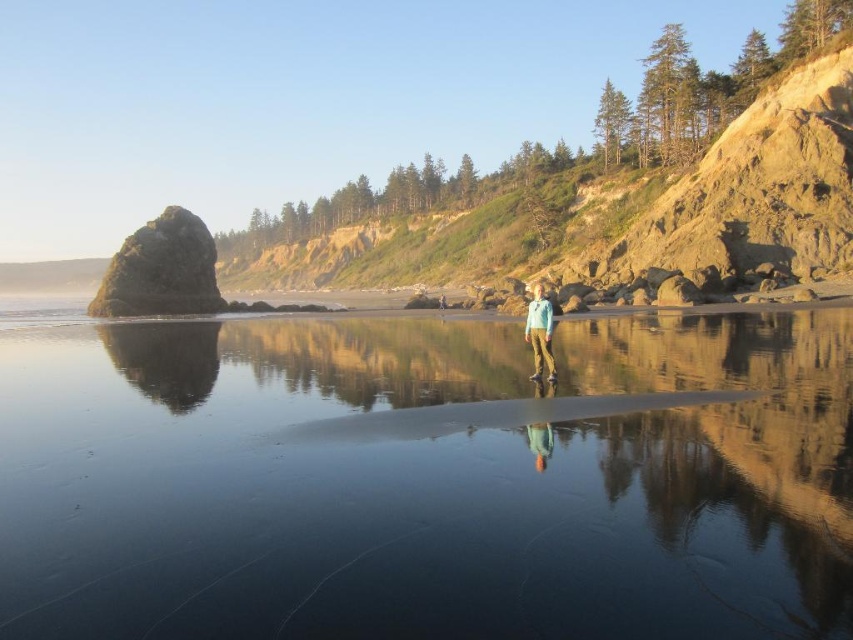
Question: Can you confirm if glossy reflective water at center is positioned below matte blue jacket at center?

Choices:
 (A) yes
 (B) no

Answer: (A)

Question: Is the position of glossy reflective water at center more distant than that of matte blue jacket at center?

Choices:
 (A) yes
 (B) no

Answer: (B)

Question: Which point is farther to the camera?

Choices:
 (A) (543, 292)
 (B) (482, 364)

Answer: (A)

Question: Which point is closer to the camera?

Choices:
 (A) glossy reflective water at center
 (B) matte blue jacket at center

Answer: (A)

Question: Which of the following is the farthest from the observer?

Choices:
 (A) (546, 346)
 (B) (21, 492)

Answer: (A)

Question: Is glossy reflective water at center bigger than matte blue jacket at center?

Choices:
 (A) no
 (B) yes

Answer: (B)